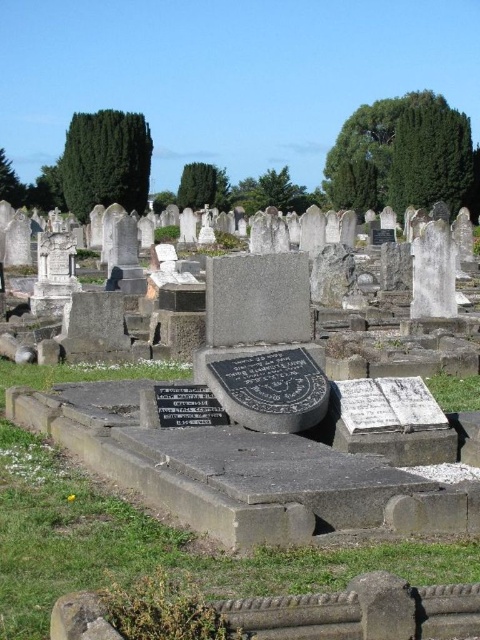
Question: Can you confirm if granite gravestone at center is thinner than black polished stone plaque at center?

Choices:
 (A) yes
 (B) no

Answer: (B)

Question: Is granite gravestone at center thinner than black polished stone plaque at center?

Choices:
 (A) no
 (B) yes

Answer: (A)

Question: Is granite gravestone at center smaller than black polished stone plaque at center?

Choices:
 (A) yes
 (B) no

Answer: (B)

Question: Which point is farther from the camera taking this photo?

Choices:
 (A) (362, 611)
 (B) (172, 417)

Answer: (B)

Question: Which of the following is the farthest from the observer?

Choices:
 (A) (420, 500)
 (B) (171, 388)

Answer: (B)

Question: Which of the following is the closest to the observer?

Choices:
 (A) [183, 426]
 (B) [457, 490]

Answer: (B)